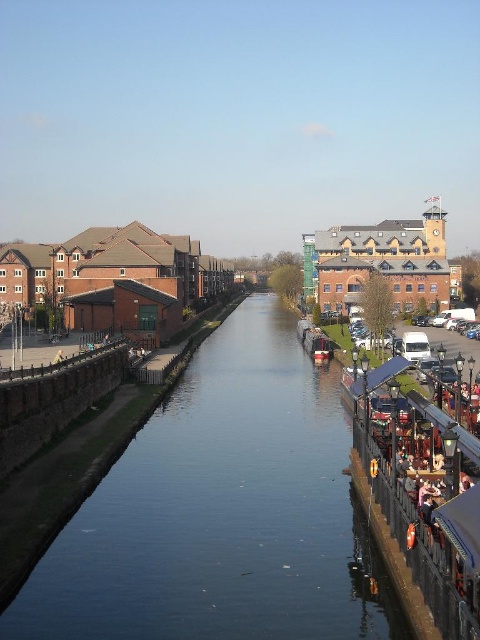
Question: Which of the following is the farthest from the observer?

Choices:
 (A) shiny red boat at center
 (B) blue smooth canal at center

Answer: (A)

Question: Is blue smooth canal at center bigger than shiny red boat at center?

Choices:
 (A) no
 (B) yes

Answer: (B)

Question: Is blue smooth canal at center positioned before shiny red boat at center?

Choices:
 (A) no
 (B) yes

Answer: (B)

Question: Which object is farther from the camera taking this photo?

Choices:
 (A) shiny red boat at center
 (B) blue smooth canal at center

Answer: (A)

Question: Is blue smooth canal at center to the right of shiny red boat at center from the viewer's perspective?

Choices:
 (A) yes
 (B) no

Answer: (B)